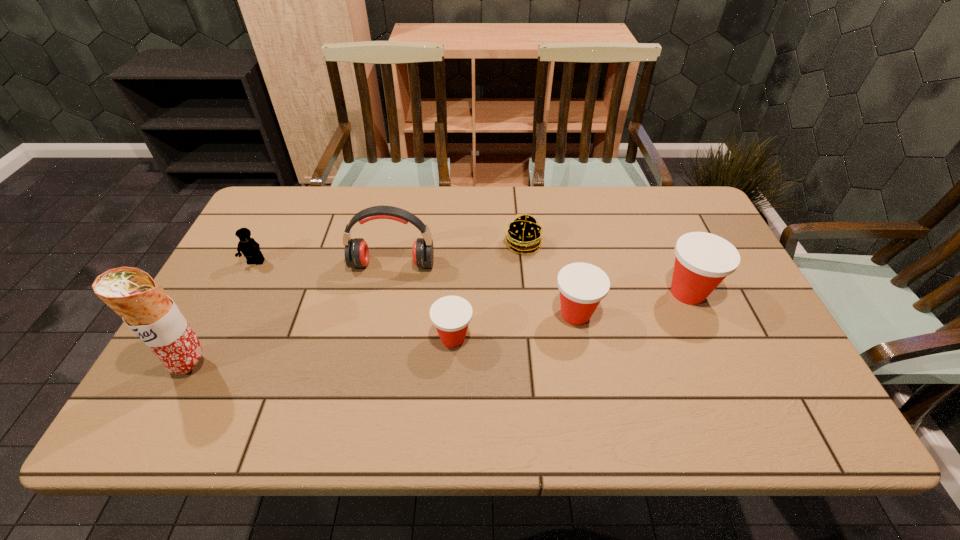
This screenshot has width=960, height=540. What are the coordinates of `empty location between the patty and the tallest object` in the screenshot? It's located at (357, 304).

Where is `vacant area that lies between the Lego and the rightmost Dixie cup`? The image size is (960, 540). vacant area that lies between the Lego and the rightmost Dixie cup is located at coordinates (471, 278).

This screenshot has width=960, height=540. I want to click on vacant area that lies between the shortest Dixie cup and the second Dixie cup from left to right, so click(515, 326).

I want to click on free space between the second Dixie cup from right to left and the Lego, so coord(416,288).

Identify the location of free space between the fifth shortest object and the second Dixie cup from right to left. The height and width of the screenshot is (540, 960). (632, 303).

Where is `free spot between the fourth object from right to left and the patty`? This screenshot has height=540, width=960. free spot between the fourth object from right to left and the patty is located at coordinates point(488,291).

This screenshot has width=960, height=540. I want to click on vacant area between the Lego and the second tallest object, so click(324, 263).

This screenshot has height=540, width=960. I want to click on free space between the tallest Dixie cup and the second Dixie cup from right to left, so click(632, 303).

Where is `object that is the third closest to the second shortest Dixie cup`? The image size is (960, 540). object that is the third closest to the second shortest Dixie cup is located at coordinates (451, 315).

This screenshot has width=960, height=540. In order to click on object that is the nearest to the leftmost Dixie cup in this screenshot , I will do `click(356, 252)`.